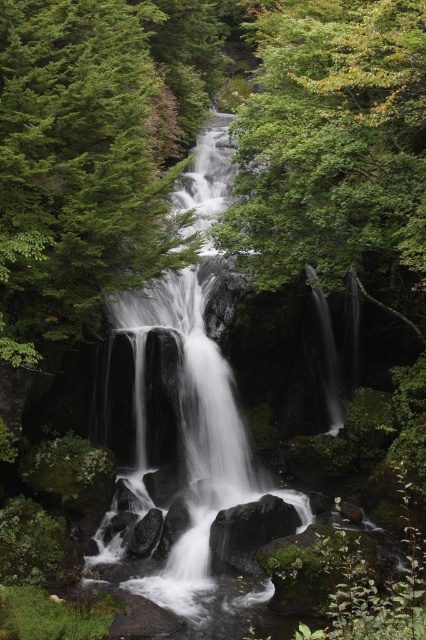
You are a hiker trying to determine the tallest tree in the scene. You see the green matte tree at center and the green leafy tree at upper center. Which tree is taller?

The green leafy tree at upper center is taller than the green matte tree at center.

You are a hiker standing at the base of the waterfall and notice two trees in the scene. Which tree is closer to your left side when facing the waterfall? The options are the green matte tree at center and the green leafy tree at upper center.

The green matte tree at center is positioned on the left side of the green leafy tree at upper center, so when facing the waterfall, the green matte tree at center would be closer to your left side.

You are a hiker trying to determine which tree is narrower between the green matte tree at center and the green leafy tree at upper center. Based on the scene description, which one should you identify as the thinner one?

The green matte tree at center is thinner than the green leafy tree at upper center, so you should identify the green matte tree at center as the thinner one.